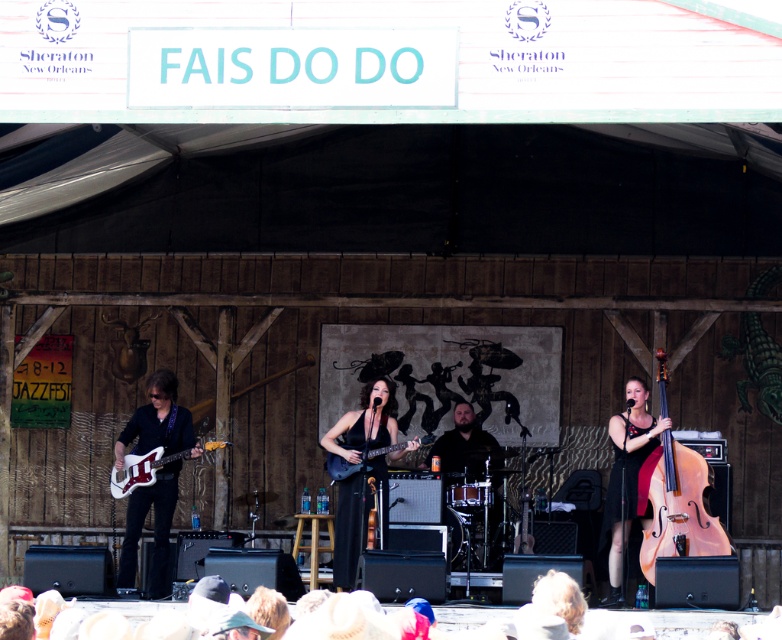
Question: Among these objects, which one is farthest from the camera?

Choices:
 (A) matte black electric guitar at center
 (B) white glossy electric guitar at lower left
 (C) light pink polished wood cello at right

Answer: (B)

Question: From the image, what is the correct spatial relationship of black matte guitar at center in relation to matte black dress at center?

Choices:
 (A) right
 (B) left

Answer: (B)

Question: Does black matte guitar at center appear on the right side of matte black dress at center?

Choices:
 (A) no
 (B) yes

Answer: (A)

Question: Which object is farther from the camera taking this photo?

Choices:
 (A) black matte guitar at center
 (B) matte black dress at center
 (C) matte black electric guitar at center

Answer: (C)

Question: Is matte black dress at center thinner than matte black electric guitar at center?

Choices:
 (A) yes
 (B) no

Answer: (A)

Question: Which object is positioned closest to the white glossy electric guitar at lower left?

Choices:
 (A) black matte guitar at center
 (B) matte black electric guitar at center
 (C) glossy white guitar at left
 (D) matte black dress at center

Answer: (C)